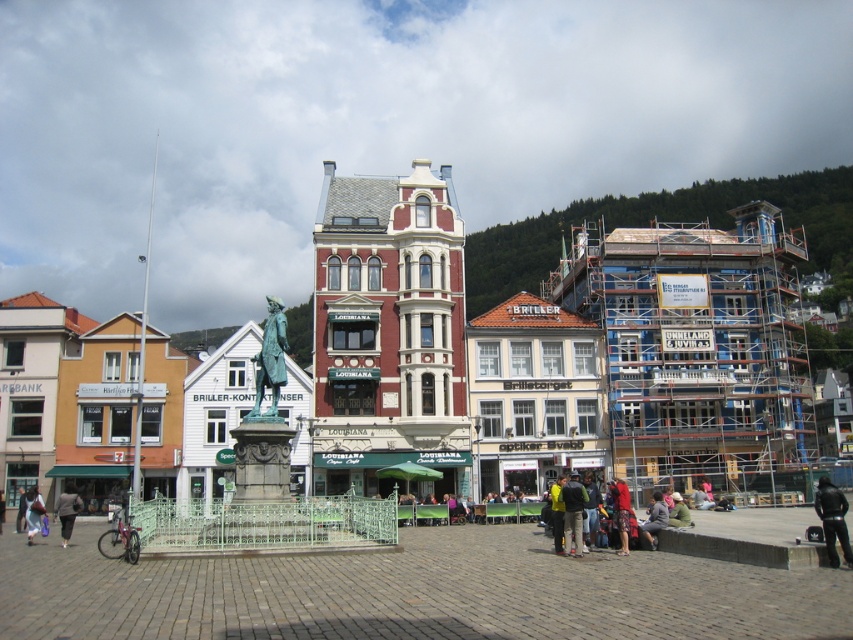
You are a delivery person who needs to place a package between the black leather jacket at lower right and the dark gray fabric jacket at lower left. The package requires a space of 45 meters. Is there enough space between them?

The distance between the black leather jacket at lower right and the dark gray fabric jacket at lower left is 45.30 meters, which is sufficient to accommodate the 45 meter package. The package can be placed there.

From the picture: You are standing in the urban square and notice two points marked on the ground. The first point is located at coordinates point (820,497) and the second at point (74,513). Which point is closer to you?

Point (820,497) is closer to the viewer than point (74,513).